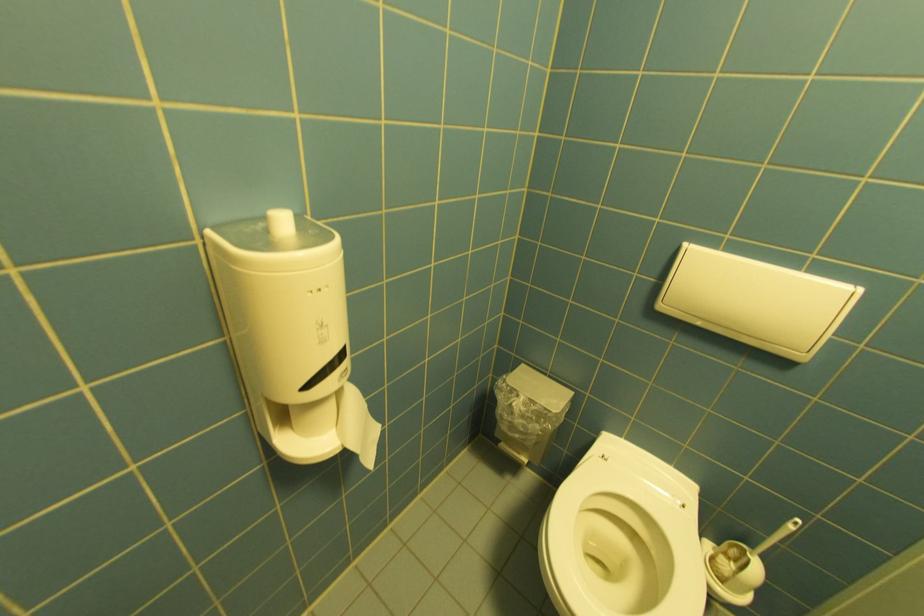
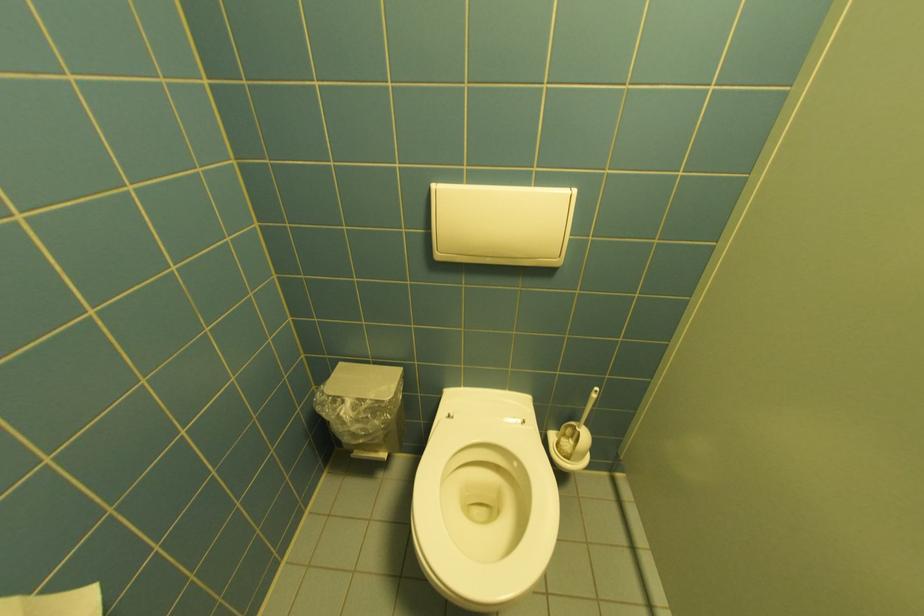
Locate, in the second image, the point that corresponds to (x=690, y=246) in the first image.

(440, 185)